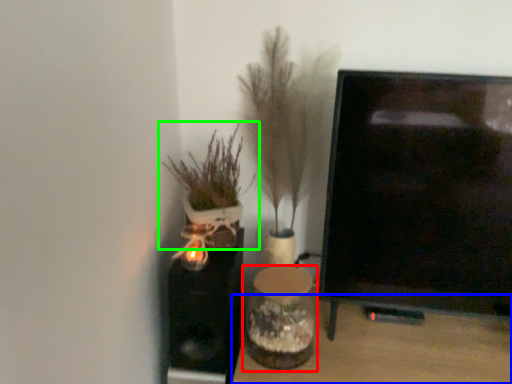
Question: Based on their relative distances, which object is farther from vase (highlighted by a red box)? Choose from furniture (highlighted by a blue box) and houseplant (highlighted by a green box).

Choices:
 (A) furniture
 (B) houseplant

Answer: (B)